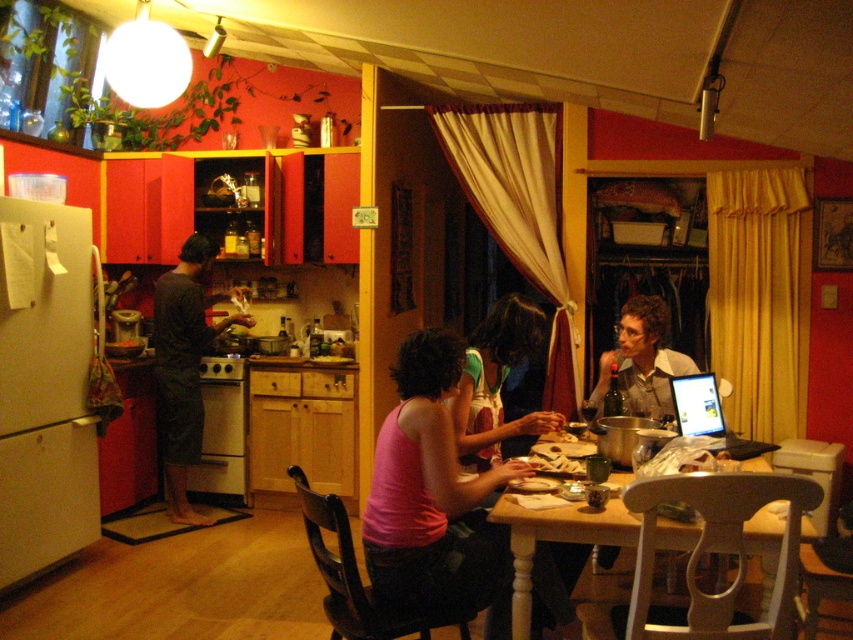
Looking at this image, which is above, pink fabric tank top at lower center or dark gray fabric at left?

Positioned higher is dark gray fabric at left.

Identify the location of pink fabric tank top at lower center. (434, 499).

Can you confirm if pink fabric tank top at lower center is taller than light brown wooden table at center?

Yes, pink fabric tank top at lower center is taller than light brown wooden table at center.

The width and height of the screenshot is (853, 640). What do you see at coordinates (434, 499) in the screenshot?
I see `pink fabric tank top at lower center` at bounding box center [434, 499].

What are the coordinates of `pink fabric tank top at lower center` in the screenshot? It's located at (434, 499).

Identify the location of pink fabric tank top at lower center. Image resolution: width=853 pixels, height=640 pixels. (434, 499).

Is dark gray fabric at left positioned at the back of light brown wooden table at center?

Yes, dark gray fabric at left is behind light brown wooden table at center.

Does point (161, 433) come farther from viewer compared to point (511, 600)?

Yes.

Find the location of `dark gray fabric at left`. dark gray fabric at left is located at coordinates (183, 369).